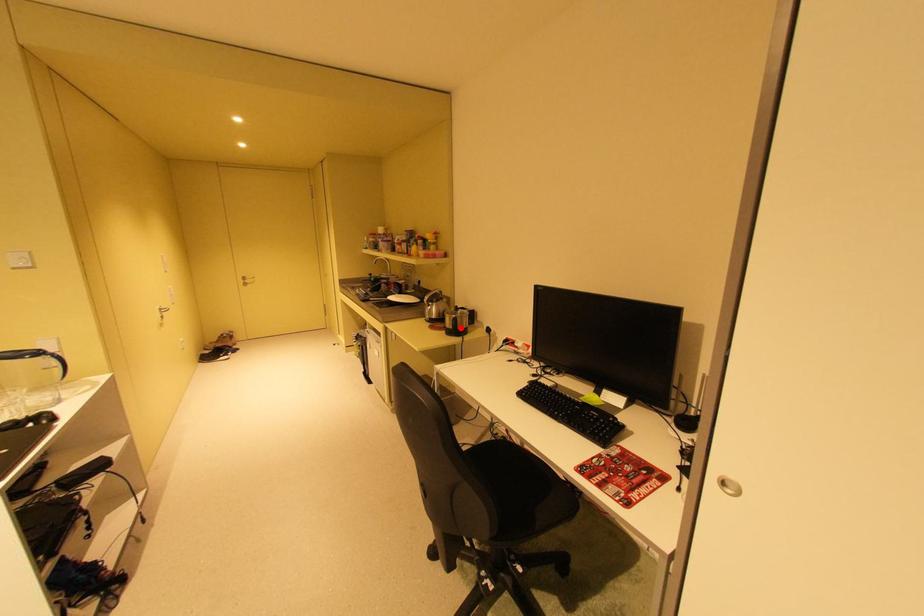
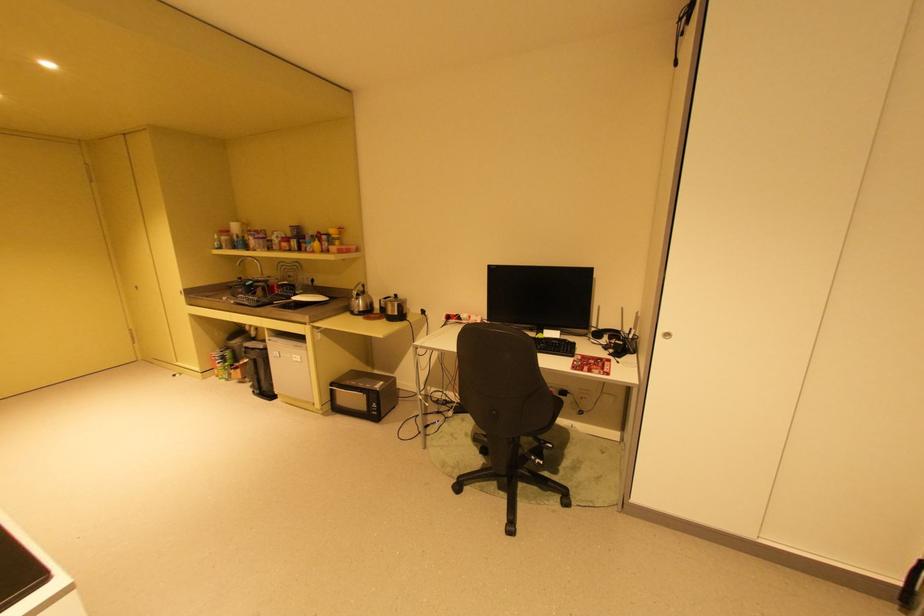
Question: I am providing you with two images of the same scene from different viewpoints. A red point is marked on the first image. Is the red point's position out of view in image 2?

Choices:
 (A) Yes
 (B) No

Answer: (B)